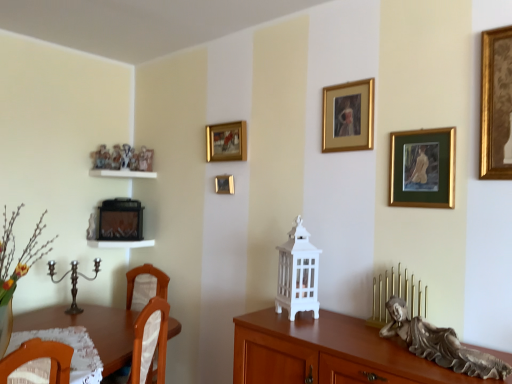
What is the approximate width of gold metallic candle holder at lower right, which appears as the 2th candle holder when viewed from the left?

2.91 inches.

How much space does gold/glass picture frame at upper right, acting as the first picture frame starting from the front, occupy vertically?

It is 13.47 inches.

Identify the location of gold metallic candle holder at lower right, arranged as the 1th candle holder when viewed from the right. (386, 295).

Could you tell me if gold metallic picture frame at center, the first picture frame in the left-to-right sequence, is turned towards gold/glass picture frame at upper right, acting as the first picture frame starting from the front?

No, gold metallic picture frame at center, the first picture frame in the left-to-right sequence, is not turned towards gold/glass picture frame at upper right, acting as the first picture frame starting from the front.

Considering the sizes of gold metallic picture frame at center, the first picture frame in the left-to-right sequence, and gold/glass picture frame at upper right, placed as the fourth picture frame when sorted from back to front, in the image, is gold metallic picture frame at center, the first picture frame in the left-to-right sequence, taller or shorter than gold/glass picture frame at upper right, placed as the fourth picture frame when sorted from back to front,?

In the image, gold metallic picture frame at center, the first picture frame in the left-to-right sequence, appears to be shorter than gold/glass picture frame at upper right, placed as the fourth picture frame when sorted from back to front.

Does point (232, 178) appear closer or farther from the camera than point (394, 191)?

Point (232, 178) is positioned farther from the camera compared to point (394, 191).

Considering the positions of objects gold metallic picture frame at center, the first picture frame in the left-to-right sequence, and gold/glass picture frame at upper right, acting as the first picture frame starting from the front, in the image provided, who is behind, gold metallic picture frame at center, the first picture frame in the left-to-right sequence, or gold/glass picture frame at upper right, acting as the first picture frame starting from the front,?

Positioned behind is gold metallic picture frame at center, the first picture frame in the left-to-right sequence.

Is point (233, 150) farther from camera compared to point (101, 240)?

No, it is in front of (101, 240).

From the image's perspective, does gold/glossy picture frame at upper center, marked as the third picture frame in a front-to-back arrangement, appear lower than white glossy shelf at center, which ranks as the second shelf in top-to-bottom order?

Incorrect, from the image's perspective, gold/glossy picture frame at upper center, marked as the third picture frame in a front-to-back arrangement, is higher than white glossy shelf at center, which ranks as the second shelf in top-to-bottom order.

From a real-world perspective, which is physically below, gold/glossy picture frame at upper center, marked as the third picture frame in a front-to-back arrangement, or white glossy shelf at center, which ranks as the second shelf in top-to-bottom order?

From a 3D spatial view, white glossy shelf at center, which ranks as the second shelf in top-to-bottom order, is below.

Considering the sizes of gold/glossy picture frame at upper center, marked as the third picture frame in a front-to-back arrangement, and white glossy shelf at center, which ranks as the second shelf in top-to-bottom order, in the image, is gold/glossy picture frame at upper center, marked as the third picture frame in a front-to-back arrangement, taller or shorter than white glossy shelf at center, which ranks as the second shelf in top-to-bottom order,?

In the image, gold/glossy picture frame at upper center, marked as the third picture frame in a front-to-back arrangement, appears to be taller than white glossy shelf at center, which ranks as the second shelf in top-to-bottom order.

Identify the location of sculpture on the right of the white glossy shelf at center, arranged as the first shelf when ordered from the bottom. This screenshot has height=384, width=512. (440, 344).

Is point (93, 242) behind point (502, 369)?

Yes.

Is white glossy shelf at center, which ranks as the second shelf in top-to-bottom order, taller or shorter than bronze statue at lower right?

white glossy shelf at center, which ranks as the second shelf in top-to-bottom order, is shorter than bronze statue at lower right.

Between gold metallic candle holder at lower right, arranged as the first candle holder when viewed from the front, and gold-framed painting at upper center, the second picture frame in the front-to-back sequence, which one has smaller width?

gold-framed painting at upper center, the second picture frame in the front-to-back sequence.

Can you tell me how much gold metallic candle holder at lower right, arranged as the first candle holder when viewed from the front, and gold-framed painting at upper center, arranged as the third picture frame when viewed from the back, differ in facing direction?

The angle between the facing direction of gold metallic candle holder at lower right, arranged as the first candle holder when viewed from the front, and the facing direction of gold-framed painting at upper center, arranged as the third picture frame when viewed from the back, is 0.268 degrees.

Between gold metallic candle holder at lower right, arranged as the first candle holder when viewed from the front, and gold-framed painting at upper center, arranged as the third picture frame when viewed from the back, which one has smaller size?

Smaller between the two is gold-framed painting at upper center, arranged as the third picture frame when viewed from the back.

From the image's perspective, between gold metallic candle holder at lower right, arranged as the 1th candle holder when viewed from the right, and gold-framed painting at upper center, the second picture frame in the front-to-back sequence, which one is located above?

gold-framed painting at upper center, the second picture frame in the front-to-back sequence, from the image's perspective.

Which object is positioned more to the left, polished silver candle holder at lower left, arranged as the 1th candle holder when viewed from the left, or gold metallic picture frame at center, marked as the fourth picture frame in a front-to-back arrangement?

Positioned to the left is polished silver candle holder at lower left, arranged as the 1th candle holder when viewed from the left.

Between point (53, 263) and point (228, 190), which one is positioned in front?

Point (228, 190)

Looking at their sizes, would you say polished silver candle holder at lower left, positioned as the second candle holder in right-to-left order, is wider or thinner than gold metallic picture frame at center, the first picture frame in the left-to-right sequence?

Considering their sizes, polished silver candle holder at lower left, positioned as the second candle holder in right-to-left order, looks broader than gold metallic picture frame at center, the first picture frame in the left-to-right sequence.

Does polished silver candle holder at lower left, arranged as the 1th candle holder when viewed from the left, have a lesser height compared to gold metallic picture frame at center, the fourth picture frame positioned from the right?

Incorrect, the height of polished silver candle holder at lower left, arranged as the 1th candle holder when viewed from the left, does not fall short of that of gold metallic picture frame at center, the fourth picture frame positioned from the right.

How far apart are brown wooden desk at lower left and gold metallic picture frame at center, the 1th picture frame positioned from the back?

1.06 meters.

Is gold metallic picture frame at center, the first picture frame in the left-to-right sequence, a part of brown wooden desk at lower left?

Actually, gold metallic picture frame at center, the first picture frame in the left-to-right sequence, is outside brown wooden desk at lower left.

Consider the image. Is brown wooden desk at lower left looking in the opposite direction of gold metallic picture frame at center, marked as the fourth picture frame in a front-to-back arrangement?

No, brown wooden desk at lower left is not facing the opposite direction of gold metallic picture frame at center, marked as the fourth picture frame in a front-to-back arrangement.

From the image's perspective, which is above, brown wooden desk at lower left or gold metallic picture frame at center, marked as the fourth picture frame in a front-to-back arrangement?

gold metallic picture frame at center, marked as the fourth picture frame in a front-to-back arrangement, is shown above in the image.

Would you say white glossy shelf at upper left, which is the 2th shelf from bottom to top, contains polished silver candle holder at lower left, arranged as the first candle holder when viewed from the back?

No, white glossy shelf at upper left, which is the 2th shelf from bottom to top, does not contain polished silver candle holder at lower left, arranged as the first candle holder when viewed from the back.

What's the angular difference between white glossy shelf at upper left, which is the 2th shelf from bottom to top, and polished silver candle holder at lower left, the 2th candle holder in the front-to-back sequence,'s facing directions?

80.4 degrees separate the facing orientations of white glossy shelf at upper left, which is the 2th shelf from bottom to top, and polished silver candle holder at lower left, the 2th candle holder in the front-to-back sequence.

In terms of height, does white glossy shelf at upper left, the first shelf in the top-to-bottom sequence, look taller or shorter compared to polished silver candle holder at lower left, the 2th candle holder in the front-to-back sequence?

white glossy shelf at upper left, the first shelf in the top-to-bottom sequence, is shorter than polished silver candle holder at lower left, the 2th candle holder in the front-to-back sequence.

Does white glossy shelf at upper left, the first shelf in the top-to-bottom sequence, have a greater width compared to polished silver candle holder at lower left, positioned as the second candle holder in right-to-left order?

Yes, white glossy shelf at upper left, the first shelf in the top-to-bottom sequence, is wider than polished silver candle holder at lower left, positioned as the second candle holder in right-to-left order.

From the image's perspective, count 1st picture frames upward from the gold metallic picture frame at center, the fourth picture frame positioned from the right, and point to it. Please provide its 2D coordinates.

[(423, 168)]

The image size is (512, 384). I want to click on the 1st shelf behind the gold/glossy picture frame at upper center, arranged as the third picture frame when viewed from the right, starting your count from the anchor, so click(x=120, y=244).

Considering their positions, is white glossy shelf at center, which ranks as the second shelf in top-to-bottom order, positioned further to gold/glossy picture frame at upper center, marked as the third picture frame in a front-to-back arrangement, than wooden cabinet at center?

Among the two, wooden cabinet at center is located further to gold/glossy picture frame at upper center, marked as the third picture frame in a front-to-back arrangement.

Looking at this image, from the image, which object appears to be farther from gold/glossy picture frame at upper center, which is the second picture frame from left to right, gold metallic candle holder at lower right, which appears as the 2th candle holder when viewed from the left, or gold/glass picture frame at upper right, arranged as the first picture frame when viewed from the right?

gold metallic candle holder at lower right, which appears as the 2th candle holder when viewed from the left, lies further to gold/glossy picture frame at upper center, which is the second picture frame from left to right, than the other object.

When comparing their distances from bronze statue at lower right, does gold-framed painting at upper center, the second picture frame positioned from the right, or white glossy shelf at upper left, which is the 2th shelf from bottom to top, seem closer?

The object closer to bronze statue at lower right is gold-framed painting at upper center, the second picture frame positioned from the right.

From the image, which object appears to be farther from bronze statue at lower right, gold/glass picture frame at upper right, placed as the fourth picture frame when sorted from back to front, or white glossy shelf at upper left, the first shelf in the top-to-bottom sequence?

white glossy shelf at upper left, the first shelf in the top-to-bottom sequence, is further to bronze statue at lower right.

Considering their positions, is brown wooden desk at lower left positioned further to gold/glass picture frame at upper right, acting as the first picture frame starting from the front, than wooden cabinet at center?

The object further to gold/glass picture frame at upper right, acting as the first picture frame starting from the front, is brown wooden desk at lower left.

Which object lies further to the anchor point gold/glossy picture frame at upper center, arranged as the third picture frame when viewed from the right, white glossy shelf at upper left, which is the 2th shelf from bottom to top, or wooden cabinet at center?

wooden cabinet at center is positioned further to the anchor gold/glossy picture frame at upper center, arranged as the third picture frame when viewed from the right.

From the image, which object appears to be farther from gold metallic candle holder at lower right, arranged as the first candle holder when viewed from the front, brown wooden desk at lower left or gold/glass picture frame at upper right, placed as the fourth picture frame when sorted from back to front?

Based on the image, brown wooden desk at lower left appears to be further to gold metallic candle holder at lower right, arranged as the first candle holder when viewed from the front.

When comparing their distances from polished silver candle holder at lower left, positioned as the second candle holder in right-to-left order, does white glossy shelf at upper left, the first shelf in the top-to-bottom sequence, or gold-framed painting at upper center, the second picture frame positioned from the right, seem further?

gold-framed painting at upper center, the second picture frame positioned from the right, is further to polished silver candle holder at lower left, positioned as the second candle holder in right-to-left order.

The image size is (512, 384). What are the coordinates of `candle holder between brown wooden desk at lower left and white glossy shelf at center, which ranks as the second shelf in top-to-bottom order, from front to back` in the screenshot? It's located at (73, 281).

This screenshot has width=512, height=384. Find the location of `sculpture between wooden cabinet at center and white glossy shelf at center, which ranks as the second shelf in top-to-bottom order, in the front-back direction`. sculpture between wooden cabinet at center and white glossy shelf at center, which ranks as the second shelf in top-to-bottom order, in the front-back direction is located at coordinates (440, 344).

Find the location of a particular element. shelf between white glossy shelf at center, arranged as the first shelf when ordered from the bottom, and gold metallic candle holder at lower right, arranged as the 1th candle holder when viewed from the right, from left to right is located at coordinates (122, 174).

Image resolution: width=512 pixels, height=384 pixels. I want to click on desk between polished silver candle holder at lower left, the 2th candle holder in the front-to-back sequence, and gold metallic candle holder at lower right, arranged as the 1th candle holder when viewed from the right, from left to right, so click(88, 329).